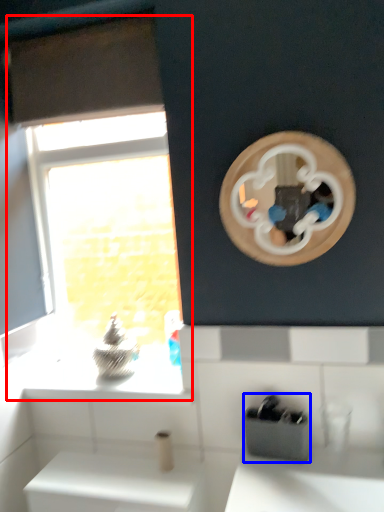
Question: Which of the following is the closest to the observer, window (highlighted by a red box) or appliance (highlighted by a blue box)?

Choices:
 (A) window
 (B) appliance

Answer: (B)